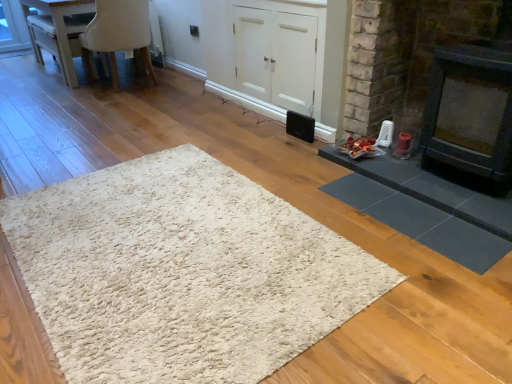
Question: From a real-world perspective, is white glossy table at upper left positioned under white matte cabinet at center based on gravity?

Choices:
 (A) yes
 (B) no

Answer: (A)

Question: Is white glossy table at upper left closer to the viewer compared to white matte cabinet at center?

Choices:
 (A) no
 (B) yes

Answer: (A)

Question: Is white glossy table at upper left smaller than white matte cabinet at center?

Choices:
 (A) no
 (B) yes

Answer: (B)

Question: Is white glossy table at upper left taller than white matte cabinet at center?

Choices:
 (A) no
 (B) yes

Answer: (A)

Question: Is white glossy table at upper left bigger than white matte cabinet at center?

Choices:
 (A) no
 (B) yes

Answer: (A)

Question: Can you confirm if white glossy table at upper left is positioned to the right of white matte cabinet at center?

Choices:
 (A) no
 (B) yes

Answer: (A)

Question: Is beige fabric chair at upper left turned away from white matte cabinet at center?

Choices:
 (A) no
 (B) yes

Answer: (B)

Question: Is beige fabric chair at upper left positioned in front of white matte cabinet at center?

Choices:
 (A) yes
 (B) no

Answer: (B)

Question: Could you tell me if beige fabric chair at upper left is facing white matte cabinet at center?

Choices:
 (A) yes
 (B) no

Answer: (B)

Question: Could white matte cabinet at center be considered to be inside beige fabric chair at upper left?

Choices:
 (A) yes
 (B) no

Answer: (B)

Question: Considering the relative sizes of beige fabric chair at upper left and white matte cabinet at center in the image provided, is beige fabric chair at upper left smaller than white matte cabinet at center?

Choices:
 (A) no
 (B) yes

Answer: (B)

Question: Considering the relative sizes of beige fabric chair at upper left and white matte cabinet at center in the image provided, is beige fabric chair at upper left wider than white matte cabinet at center?

Choices:
 (A) no
 (B) yes

Answer: (B)

Question: Is white glossy table at upper left thinner than beige fabric chair at upper left?

Choices:
 (A) yes
 (B) no

Answer: (A)